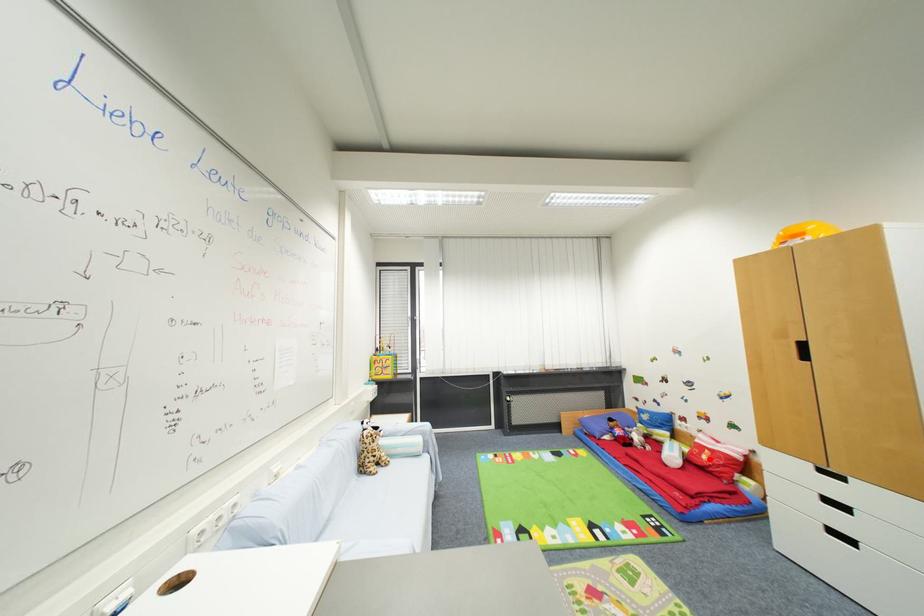
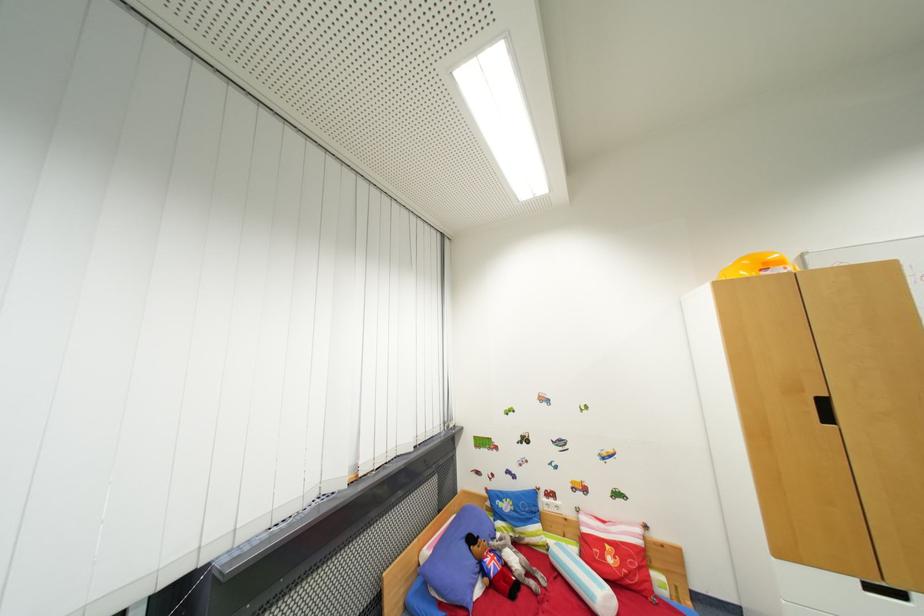
The point at the highlighted location is marked in the first image. Where is the corresponding point in the second image?

(614, 562)